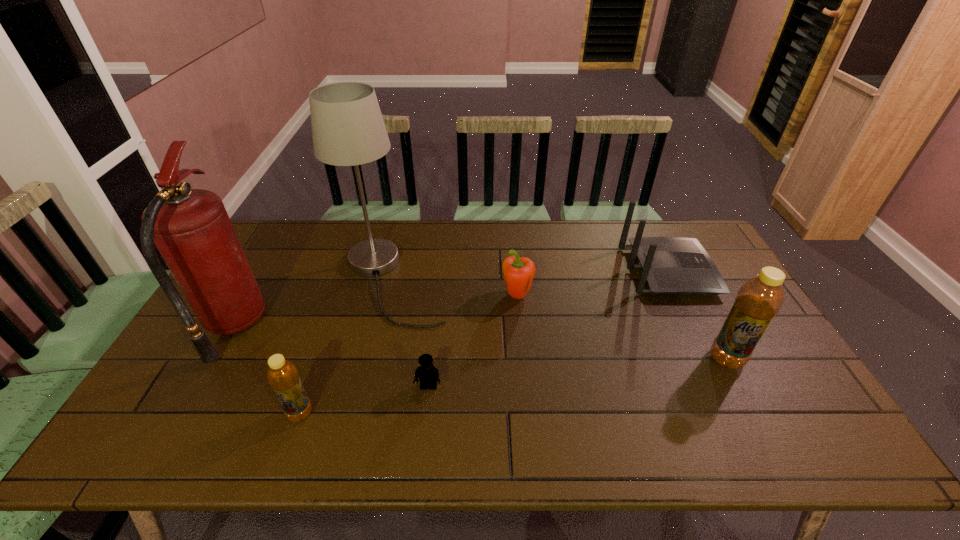
Find the location of a particular element. This screenshot has width=960, height=540. the nearest object is located at coordinates (282, 375).

Where is `the nearer bottle`? This screenshot has height=540, width=960. the nearer bottle is located at coordinates (282, 375).

You are a GUI agent. You are given a task and a screenshot of the screen. Output one action in this format:
    pyautogui.click(x=<x>, y=<y>)
    Task: Click on the taller bottle
    The image size is (960, 540).
    Given the screenshot: What is the action you would take?
    pyautogui.click(x=759, y=299)

At what (x,y) coordinates should I click in order to perform the action: click on the fifth shortest object. Please return your answer as a coordinate pair (x, y). Looking at the image, I should click on (759, 299).

I want to click on the fifth object from left to right, so click(x=518, y=273).

Locate an element on the screen. The image size is (960, 540). the sixth tallest object is located at coordinates (518, 273).

Where is `router`? The height and width of the screenshot is (540, 960). router is located at coordinates (669, 265).

The height and width of the screenshot is (540, 960). What are the coordinates of `the leftmost object` in the screenshot? It's located at (191, 228).

Where is `table lamp`? The image size is (960, 540). table lamp is located at coordinates (348, 129).

Identify the location of the shortest object. This screenshot has height=540, width=960. (427, 373).